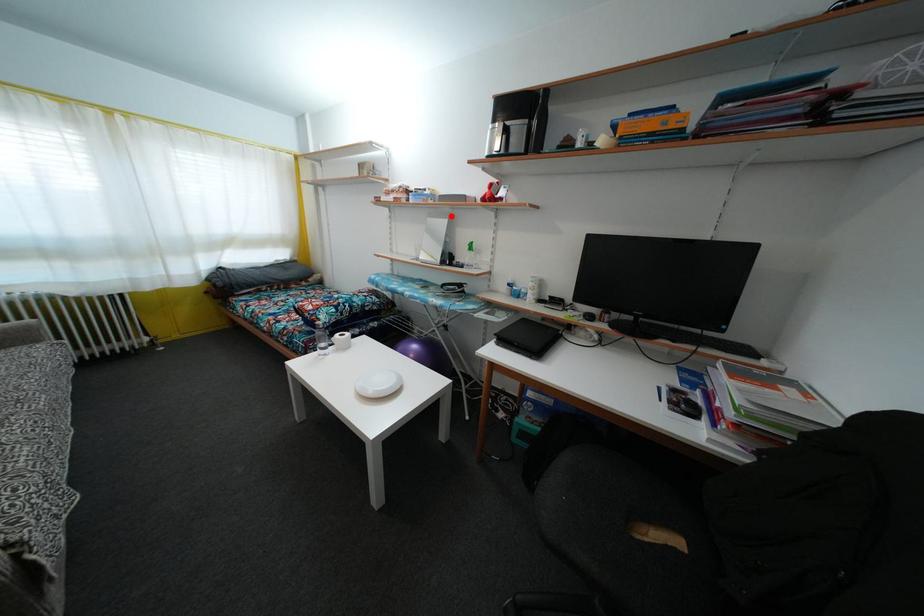
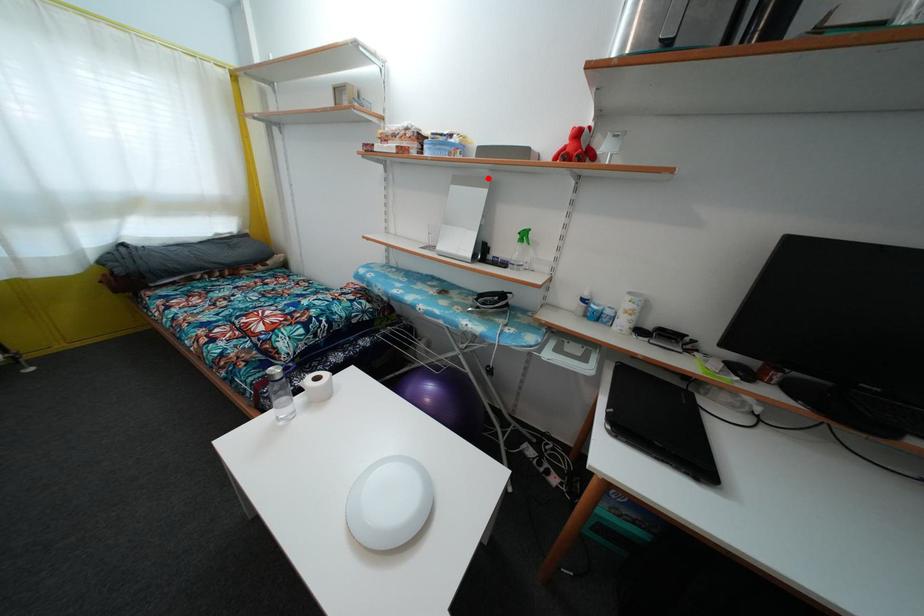
I am providing you with two images of the same scene from different viewpoints. A red point is marked on the first image and another point is marked on the second image. Are the points marked in image1 and image2 representing the same 3D position?

Yes